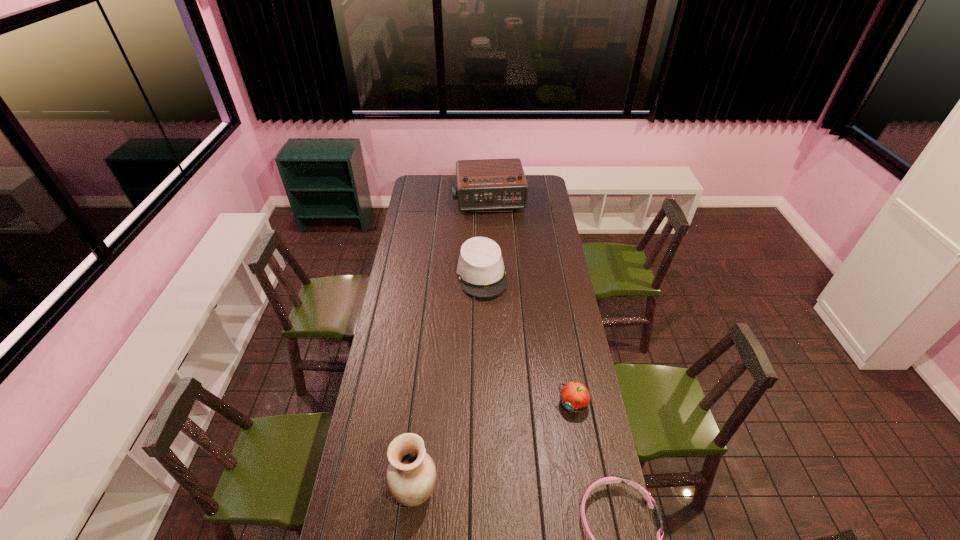
Locate an element on the screen. The height and width of the screenshot is (540, 960). vacant region at the far edge is located at coordinates (447, 186).

You are a GUI agent. You are given a task and a screenshot of the screen. Output one action in this format:
    pyautogui.click(x=<x>, y=<y>)
    Task: Click on the vacant space at the near edge of the desktop
    The image size is (960, 540).
    Given the screenshot: What is the action you would take?
    pyautogui.click(x=540, y=509)

Locate an element on the screen. blank space at the left edge of the desktop is located at coordinates (409, 221).

Identify the location of vacant region at the right edge of the desktop. This screenshot has height=540, width=960. (558, 272).

This screenshot has width=960, height=540. Identify the location of free space at the far left corner of the desktop. (430, 180).

Locate an element on the screen. This screenshot has width=960, height=540. free space at the far right corner of the desktop is located at coordinates (549, 194).

The height and width of the screenshot is (540, 960). I want to click on free space at the near right corner, so click(598, 514).

Where is `vacant space that is in between the third nearest object and the farthest object`? The height and width of the screenshot is (540, 960). vacant space that is in between the third nearest object and the farthest object is located at coordinates point(531,302).

I want to click on empty location between the fourth shortest object and the apple, so click(x=531, y=302).

This screenshot has width=960, height=540. Identify the location of vacant area that lies between the radio receiver and the pottery. (452, 346).